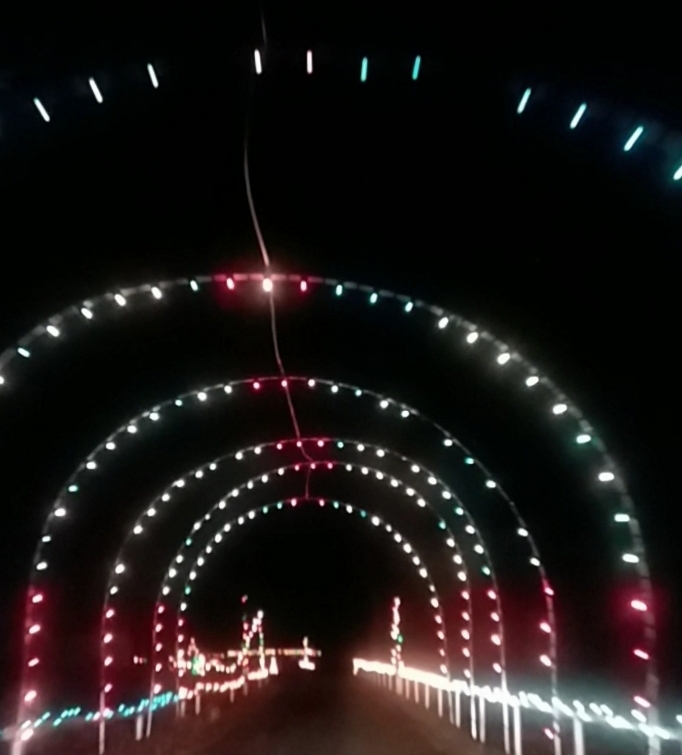
Locate an element on the screen. This screenshot has width=682, height=755. archway is located at coordinates (241, 516), (237, 492), (213, 467), (218, 384), (228, 275), (417, 69).